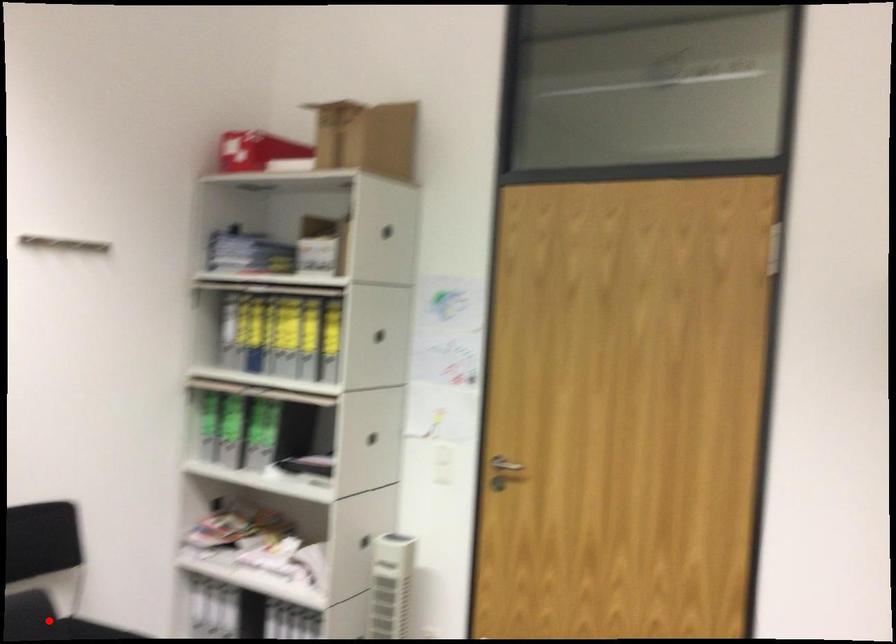
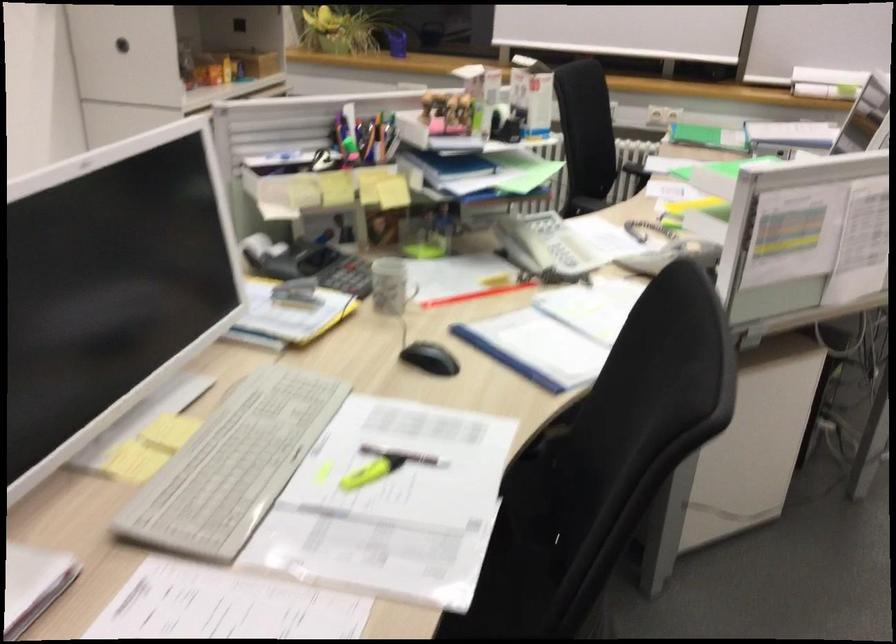
Question: I am providing you with two images of the same scene from different viewpoints. A red point is marked on the first image. Is the red point's position out of view in image 2?

Choices:
 (A) Yes
 (B) No

Answer: (A)